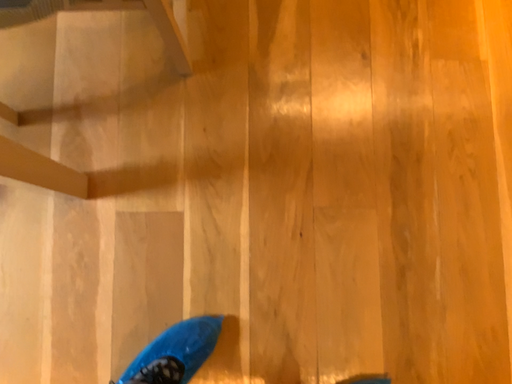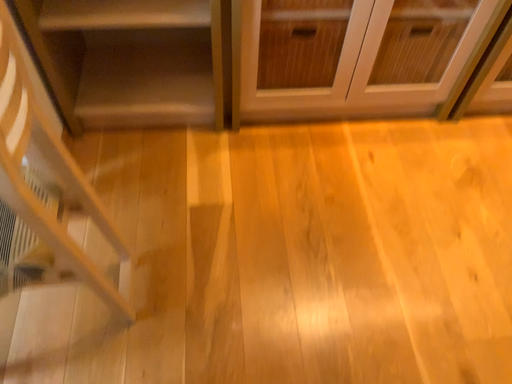
Question: How did the camera likely rotate when shooting the video?

Choices:
 (A) rotated downward
 (B) rotated upward

Answer: (B)